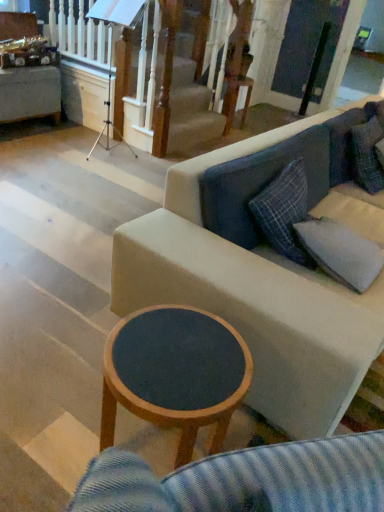
Question: Considering the relative positions of gray fabric pillow at right and fabric couch at center in the image provided, is gray fabric pillow at right to the left or to the right of fabric couch at center?

Choices:
 (A) left
 (B) right

Answer: (A)

Question: From a real-world perspective, relative to fabric couch at center, is gray fabric pillow at right vertically above or below?

Choices:
 (A) above
 (B) below

Answer: (A)

Question: Which object is positioned farthest from the gray fabric pillow at right?

Choices:
 (A) wooden round table at center
 (B) fabric couch at center
 (C) wooden round table at upper center

Answer: (C)

Question: Which is farther from the wooden round table at center?

Choices:
 (A) fabric couch at center
 (B) wooden round table at upper center
 (C) gray fabric pillow at right

Answer: (B)